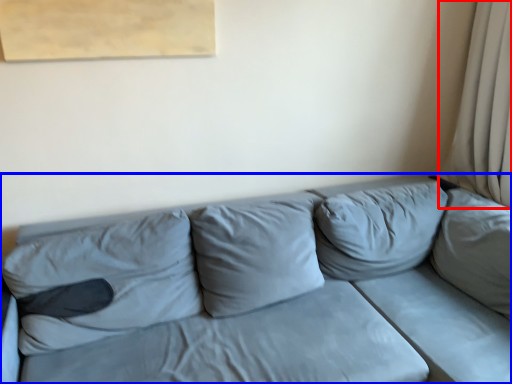
Question: Which object appears closest to the camera in this image, curtain (highlighted by a red box) or studio couch (highlighted by a blue box)?

Choices:
 (A) curtain
 (B) studio couch

Answer: (B)